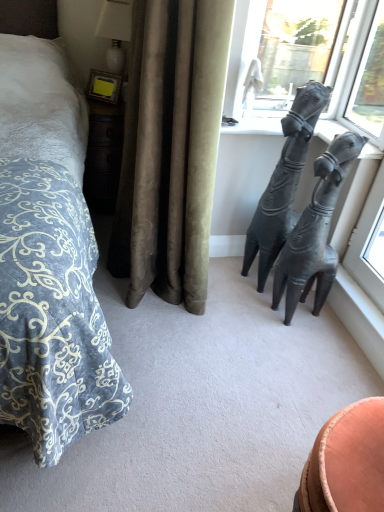
The height and width of the screenshot is (512, 384). Find the location of `vacant area that is in front of black matte hand sculpture at upper right, the second statue (sculpture) positioned from the left`. vacant area that is in front of black matte hand sculpture at upper right, the second statue (sculpture) positioned from the left is located at coordinates (297, 339).